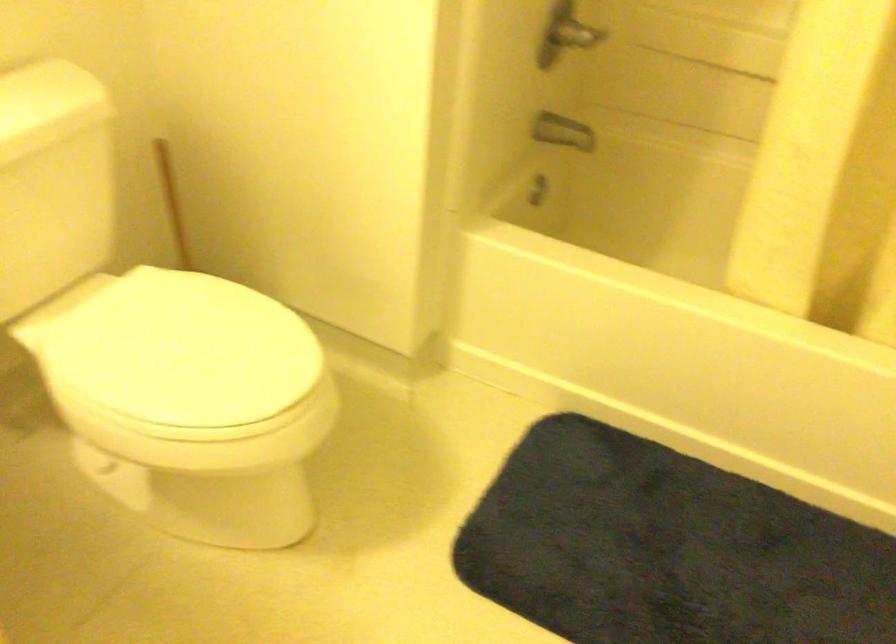
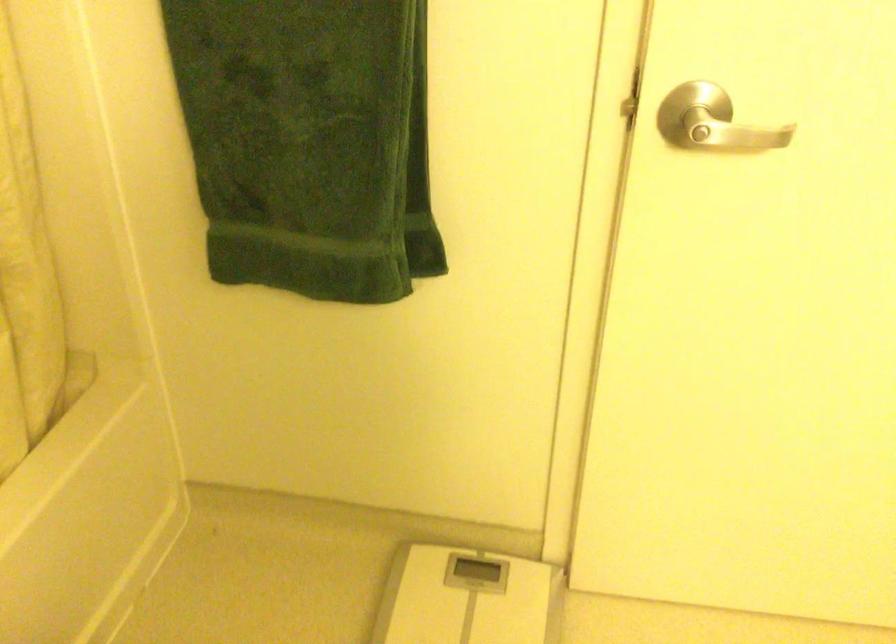
How did the camera likely rotate?

The camera rotated toward right-down.